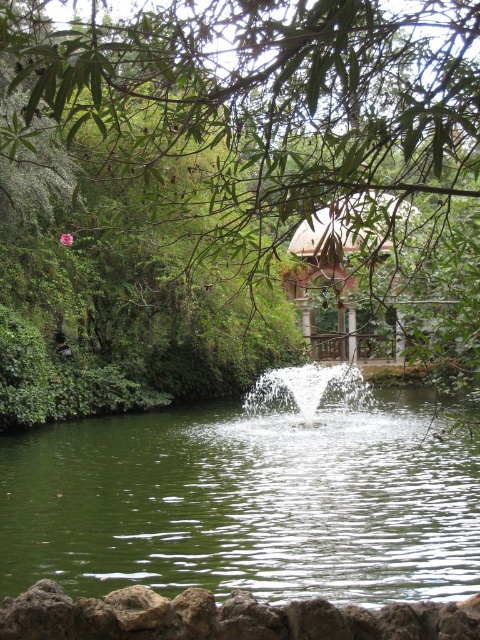
Is green liquid water at center to the right of wooden gazebo at center from the viewer's perspective?

No, green liquid water at center is not to the right of wooden gazebo at center.

The image size is (480, 640). What do you see at coordinates (249, 499) in the screenshot?
I see `green liquid water at center` at bounding box center [249, 499].

Find the location of `green liquid water at center`. green liquid water at center is located at coordinates (249, 499).

Is green leafy tree at center wider than green liquid water at center?

Incorrect, green leafy tree at center's width does not surpass green liquid water at center's.

Does point (410, 188) come farther from viewer compared to point (342, 595)?

That is False.

What are the coordinates of `green leafy tree at center` in the screenshot? It's located at (272, 109).

Locate an element on the screen. This screenshot has height=640, width=480. green leafy tree at center is located at coordinates tap(272, 109).

Is green leafy tree at center smaller than wooden gazebo at center?

No, green leafy tree at center is not smaller than wooden gazebo at center.

Does green leafy tree at center come in front of wooden gazebo at center?

Yes, green leafy tree at center is closer to the viewer.

Measure the distance between point (333, 90) and camera.

Point (333, 90) and camera are 7.76 meters apart.

The height and width of the screenshot is (640, 480). What are the coordinates of `green leafy tree at center` in the screenshot? It's located at (272, 109).